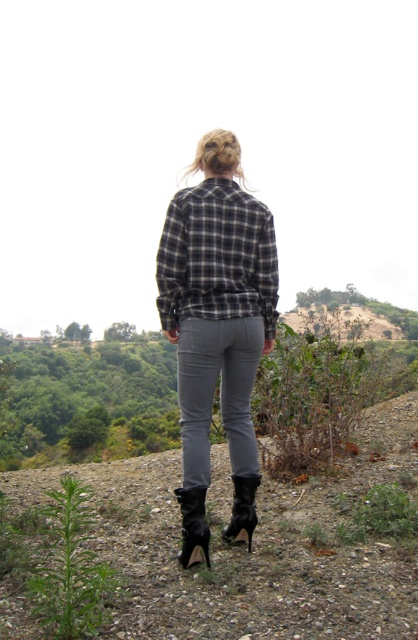
You are a photographer trying to capture the person in the image. To ensure the matte gray pants at center are in focus, where should you aim the camera? Please provide coordinates based on the image grid system where the bottom left corner is 0,0 and the top right corner is 1,1.

The matte gray pants at center are located at coordinates point (214, 392), so aim the camera at that point to ensure they are in focus.